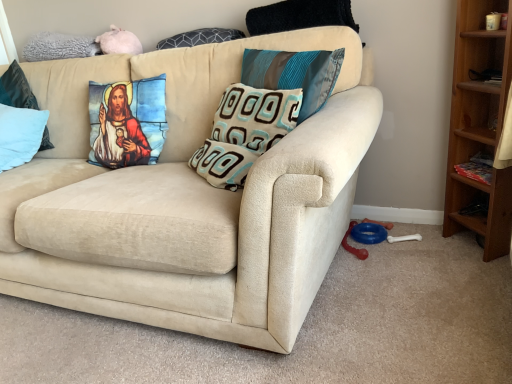
What is the approximate height of light blue fabric pillow at left, the 5th pillow viewed from the right?

light blue fabric pillow at left, the 5th pillow viewed from the right, is 34.19 centimeters tall.

Find the location of a particular element. This screenshot has height=384, width=512. dark gray textured pillow at upper center, the 3th pillow in the left-to-right sequence is located at coordinates (200, 37).

Image resolution: width=512 pixels, height=384 pixels. Describe the element at coordinates (294, 74) in the screenshot. I see `teal silk pillow at upper center, the first pillow when ordered from right to left` at that location.

Where is `beige suede couch at center`? This screenshot has width=512, height=384. beige suede couch at center is located at coordinates (188, 201).

Locate an element on the screen. This screenshot has width=512, height=384. beige textured pillow at center, which is the fourth pillow from left to right is located at coordinates (244, 132).

The height and width of the screenshot is (384, 512). In order to click on light blue fabric pillow at left, which appears as the 2th pillow when viewed from the left in this screenshot , I will do `click(16, 89)`.

What is the approximate width of light blue fabric pillow at left, which appears as the 4th pillow when viewed from the right?

The width of light blue fabric pillow at left, which appears as the 4th pillow when viewed from the right, is 7.32 inches.

This screenshot has width=512, height=384. I want to click on light blue fabric pillow at left, the 5th pillow viewed from the right, so click(20, 135).

Measure the distance between light blue fabric pillow at left, the first pillow in the left-to-right sequence, and teal silk pillow at upper center, the first pillow when ordered from right to left.

light blue fabric pillow at left, the first pillow in the left-to-right sequence, and teal silk pillow at upper center, the first pillow when ordered from right to left, are 4.01 feet apart.

Is teal silk pillow at upper center, the first pillow when ordered from right to left, inside light blue fabric pillow at left, the first pillow in the left-to-right sequence?

No, light blue fabric pillow at left, the first pillow in the left-to-right sequence, does not contain teal silk pillow at upper center, the first pillow when ordered from right to left.

Consider the image. Which object is closer to the camera taking this photo, light blue fabric pillow at left, the first pillow in the left-to-right sequence, or teal silk pillow at upper center, the fifth pillow in the left-to-right sequence?

teal silk pillow at upper center, the fifth pillow in the left-to-right sequence.

Is light blue fabric pillow at left, the first pillow in the left-to-right sequence, shorter than teal silk pillow at upper center, the fifth pillow in the left-to-right sequence?

In fact, light blue fabric pillow at left, the first pillow in the left-to-right sequence, may be taller than teal silk pillow at upper center, the fifth pillow in the left-to-right sequence.

In terms of width, does light blue fabric pillow at left, the first pillow in the left-to-right sequence, look wider or thinner when compared to dark gray textured pillow at upper center, the 3th pillow in the left-to-right sequence?

Considering their sizes, light blue fabric pillow at left, the first pillow in the left-to-right sequence, looks broader than dark gray textured pillow at upper center, the 3th pillow in the left-to-right sequence.

Based on the photo, can you confirm if light blue fabric pillow at left, the 5th pillow viewed from the right, is bigger than dark gray textured pillow at upper center, the 3th pillow in the left-to-right sequence?

Indeed, light blue fabric pillow at left, the 5th pillow viewed from the right, has a larger size compared to dark gray textured pillow at upper center, the 3th pillow in the left-to-right sequence.

From the picture: From a real-world perspective, is light blue fabric pillow at left, the first pillow in the left-to-right sequence, positioned under dark gray textured pillow at upper center, arranged as the third pillow when viewed from the right, based on gravity?

Indeed, from a real-world perspective, light blue fabric pillow at left, the first pillow in the left-to-right sequence, is positioned beneath dark gray textured pillow at upper center, arranged as the third pillow when viewed from the right.

Measure the distance from light blue fabric pillow at left, the first pillow in the left-to-right sequence, to dark gray textured pillow at upper center, the 3th pillow in the left-to-right sequence.

light blue fabric pillow at left, the first pillow in the left-to-right sequence, is 80.51 centimeters away from dark gray textured pillow at upper center, the 3th pillow in the left-to-right sequence.

Can we say teal silk pillow at upper center, the first pillow when ordered from right to left, lies outside light blue fabric pillow at left, which appears as the 4th pillow when viewed from the right?

Absolutely, teal silk pillow at upper center, the first pillow when ordered from right to left, is external to light blue fabric pillow at left, which appears as the 4th pillow when viewed from the right.

Which object is closer to the camera taking this photo, teal silk pillow at upper center, the fifth pillow in the left-to-right sequence, or light blue fabric pillow at left, which appears as the 2th pillow when viewed from the left?

teal silk pillow at upper center, the fifth pillow in the left-to-right sequence, is more forward.

Looking at this image, from a real-world perspective, is teal silk pillow at upper center, the first pillow when ordered from right to left, positioned under light blue fabric pillow at left, which appears as the 2th pillow when viewed from the left, based on gravity?

Incorrect, from a real-world perspective, teal silk pillow at upper center, the first pillow when ordered from right to left, is higher than light blue fabric pillow at left, which appears as the 2th pillow when viewed from the left.

Is teal silk pillow at upper center, the first pillow when ordered from right to left, shorter than dark gray textured pillow at upper center, the 3th pillow in the left-to-right sequence?

No.

Is teal silk pillow at upper center, the fifth pillow in the left-to-right sequence, next to dark gray textured pillow at upper center, arranged as the third pillow when viewed from the right?

There is a gap between teal silk pillow at upper center, the fifth pillow in the left-to-right sequence, and dark gray textured pillow at upper center, arranged as the third pillow when viewed from the right.

Does teal silk pillow at upper center, the first pillow when ordered from right to left, come in front of dark gray textured pillow at upper center, arranged as the third pillow when viewed from the right?

Yes, the depth of teal silk pillow at upper center, the first pillow when ordered from right to left, is less than that of dark gray textured pillow at upper center, arranged as the third pillow when viewed from the right.

From a real-world perspective, which is physically below, teal silk pillow at upper center, the fifth pillow in the left-to-right sequence, or dark gray textured pillow at upper center, arranged as the third pillow when viewed from the right?

teal silk pillow at upper center, the fifth pillow in the left-to-right sequence, from a real-world perspective.

There is a beige suede couch at center. At what (x,y) coordinates should I click in order to perform the action: click on the 5th pillow above it (from the image's perspective). Please return your answer as a coordinate pair (x, y). The width and height of the screenshot is (512, 384). Looking at the image, I should click on (200, 37).

From the image's perspective, is beige suede couch at center below dark gray textured pillow at upper center, arranged as the third pillow when viewed from the right?

Yes, from the image's perspective, beige suede couch at center is beneath dark gray textured pillow at upper center, arranged as the third pillow when viewed from the right.

Who is smaller, beige suede couch at center or dark gray textured pillow at upper center, the 3th pillow in the left-to-right sequence?

dark gray textured pillow at upper center, the 3th pillow in the left-to-right sequence.

Would you say beige textured pillow at center, which is the 2th pillow in right-to-left order, is to the left or to the right of light blue fabric pillow at left, the 5th pillow viewed from the right, in the picture?

Clearly, beige textured pillow at center, which is the 2th pillow in right-to-left order, is on the right of light blue fabric pillow at left, the 5th pillow viewed from the right, in the image.

Does beige textured pillow at center, which is the fourth pillow from left to right, have a lesser width compared to light blue fabric pillow at left, the 5th pillow viewed from the right?

Correct, the width of beige textured pillow at center, which is the fourth pillow from left to right, is less than that of light blue fabric pillow at left, the 5th pillow viewed from the right.

Could you tell me if beige textured pillow at center, which is the 2th pillow in right-to-left order, is facing light blue fabric pillow at left, the first pillow in the left-to-right sequence?

No, beige textured pillow at center, which is the 2th pillow in right-to-left order, is not aimed at light blue fabric pillow at left, the first pillow in the left-to-right sequence.

Considering the sizes of objects beige textured pillow at center, which is the fourth pillow from left to right, and light blue fabric pillow at left, the first pillow in the left-to-right sequence, in the image provided, who is shorter, beige textured pillow at center, which is the fourth pillow from left to right, or light blue fabric pillow at left, the first pillow in the left-to-right sequence,?

beige textured pillow at center, which is the fourth pillow from left to right, is shorter.

Considering the points (13, 64) and (26, 110), which point is in front, point (13, 64) or point (26, 110)?

The point (26, 110) is more forward.

Which is correct: light blue fabric pillow at left, which appears as the 4th pillow when viewed from the right, is inside light blue fabric pillow at left, the first pillow in the left-to-right sequence, or outside of it?

light blue fabric pillow at left, which appears as the 4th pillow when viewed from the right, exists outside the volume of light blue fabric pillow at left, the first pillow in the left-to-right sequence.

Does light blue fabric pillow at left, which appears as the 2th pillow when viewed from the left, have a lesser height compared to light blue fabric pillow at left, the 5th pillow viewed from the right?

Incorrect, the height of light blue fabric pillow at left, which appears as the 2th pillow when viewed from the left, does not fall short of that of light blue fabric pillow at left, the 5th pillow viewed from the right.

Based on the photo, measure the distance from light blue fabric pillow at left, which appears as the 4th pillow when viewed from the right, to light blue fabric pillow at left, the first pillow in the left-to-right sequence.

light blue fabric pillow at left, which appears as the 4th pillow when viewed from the right, is 5.47 inches from light blue fabric pillow at left, the first pillow in the left-to-right sequence.

From the image's perspective, count 1st pillows upward from the light blue fabric pillow at left, the 5th pillow viewed from the right, and point to it. Please provide its 2D coordinates.

[(294, 74)]

You are a GUI agent. You are given a task and a screenshot of the screen. Output one action in this format:
    pyautogui.click(x=<x>, y=<y>)
    Task: Click on the 2nd pillow to the left of the dark gray textured pillow at upper center, the 3th pillow in the left-to-right sequence, starting your count from the anchor
    
    Given the screenshot: What is the action you would take?
    pyautogui.click(x=20, y=135)

Based on their spatial positions, is dark gray textured pillow at upper center, the 3th pillow in the left-to-right sequence, or beige textured pillow at center, which is the fourth pillow from left to right, closer to light blue fabric pillow at left, the first pillow in the left-to-right sequence?

dark gray textured pillow at upper center, the 3th pillow in the left-to-right sequence, is closer to light blue fabric pillow at left, the first pillow in the left-to-right sequence.

Considering their positions, is light blue fabric pillow at left, the 5th pillow viewed from the right, positioned closer to beige textured pillow at center, which is the fourth pillow from left to right, than beige suede couch at center?

Based on the image, beige suede couch at center appears to be nearer to beige textured pillow at center, which is the fourth pillow from left to right.

Considering their positions, is dark gray textured pillow at upper center, arranged as the third pillow when viewed from the right, positioned further to beige suede couch at center than light blue fabric pillow at left, which appears as the 4th pillow when viewed from the right?

light blue fabric pillow at left, which appears as the 4th pillow when viewed from the right.

Based on their spatial positions, is light blue fabric pillow at left, which appears as the 2th pillow when viewed from the left, or light blue fabric pillow at left, the 5th pillow viewed from the right, closer to dark gray textured pillow at upper center, arranged as the third pillow when viewed from the right?

light blue fabric pillow at left, the 5th pillow viewed from the right, lies closer to dark gray textured pillow at upper center, arranged as the third pillow when viewed from the right, than the other object.

Estimate the real-world distances between objects in this image. Which object is further from light blue fabric pillow at left, the first pillow in the left-to-right sequence, light blue fabric pillow at left, which appears as the 2th pillow when viewed from the left, or beige suede couch at center?

beige suede couch at center.

From the image, which object appears to be nearer to light blue fabric pillow at left, the first pillow in the left-to-right sequence, teal silk pillow at upper center, the first pillow when ordered from right to left, or beige textured pillow at center, which is the fourth pillow from left to right?

beige textured pillow at center, which is the fourth pillow from left to right.

Looking at the image, which one is located closer to teal silk pillow at upper center, the fifth pillow in the left-to-right sequence, beige suede couch at center or beige textured pillow at center, which is the fourth pillow from left to right?

beige textured pillow at center, which is the fourth pillow from left to right, is closer to teal silk pillow at upper center, the fifth pillow in the left-to-right sequence.

Looking at the image, which one is located closer to dark gray textured pillow at upper center, the 3th pillow in the left-to-right sequence, beige suede couch at center or teal silk pillow at upper center, the first pillow when ordered from right to left?

Among the two, teal silk pillow at upper center, the first pillow when ordered from right to left, is located nearer to dark gray textured pillow at upper center, the 3th pillow in the left-to-right sequence.

I want to click on pillow situated between light blue fabric pillow at left, which appears as the 2th pillow when viewed from the left, and beige textured pillow at center, which is the fourth pillow from left to right, from left to right, so click(200, 37).

You are a GUI agent. You are given a task and a screenshot of the screen. Output one action in this format:
    pyautogui.click(x=<x>, y=<y>)
    Task: Click on the pillow located between light blue fabric pillow at left, the 5th pillow viewed from the right, and dark gray textured pillow at upper center, the 3th pillow in the left-to-right sequence, in the left-right direction
    Image resolution: width=512 pixels, height=384 pixels.
    Given the screenshot: What is the action you would take?
    pyautogui.click(x=16, y=89)

Find the location of a particular element. The width and height of the screenshot is (512, 384). studio couch situated between light blue fabric pillow at left, which appears as the 2th pillow when viewed from the left, and teal silk pillow at upper center, the fifth pillow in the left-to-right sequence, from left to right is located at coordinates (188, 201).

This screenshot has height=384, width=512. Find the location of `studio couch between light blue fabric pillow at left, the 5th pillow viewed from the right, and beige textured pillow at center, which is the fourth pillow from left to right, from left to right`. studio couch between light blue fabric pillow at left, the 5th pillow viewed from the right, and beige textured pillow at center, which is the fourth pillow from left to right, from left to right is located at coordinates (188, 201).